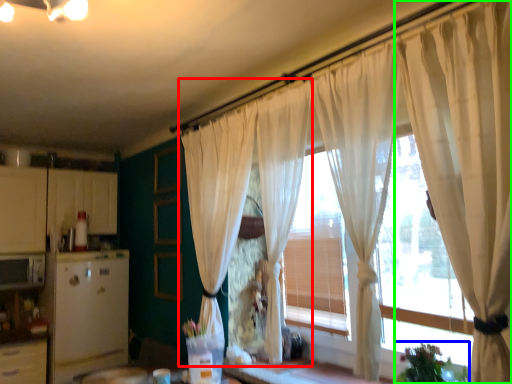
Question: Based on their relative distances, which object is farther from curtain (highlighted by a red box)? Choose from plant (highlighted by a blue box) and curtain (highlighted by a green box).

Choices:
 (A) plant
 (B) curtain

Answer: (A)